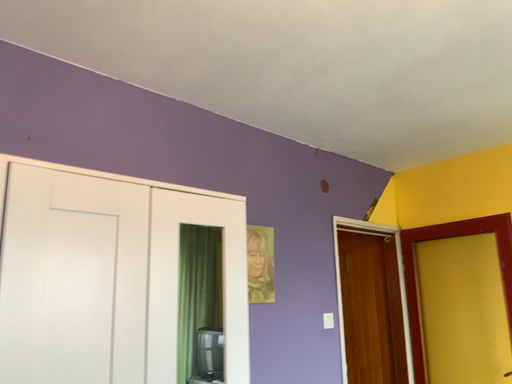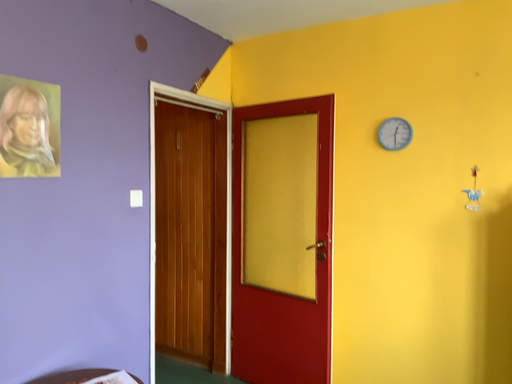
Question: Which way did the camera rotate in the video?

Choices:
 (A) rotated upward
 (B) rotated downward

Answer: (B)